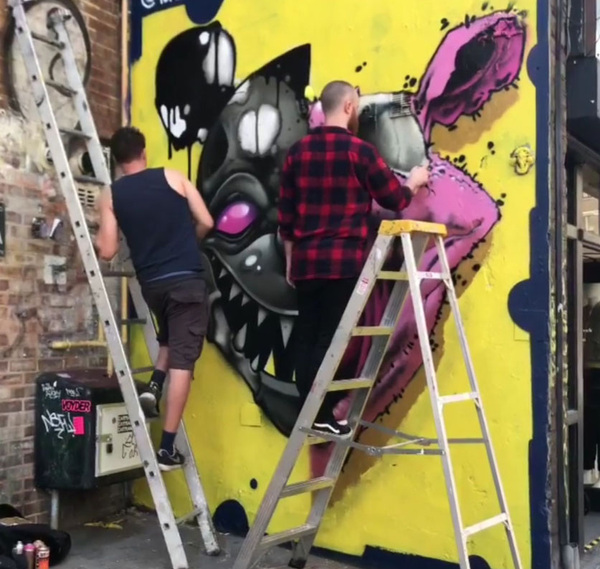
Locate an element on the screen. This screenshot has width=600, height=569. hinge is located at coordinates (373, 448), (425, 439).